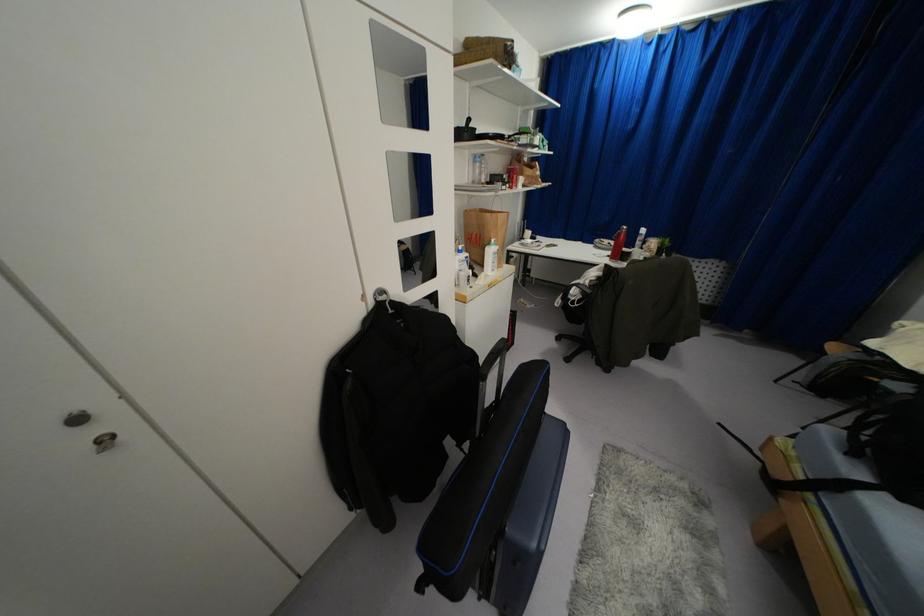
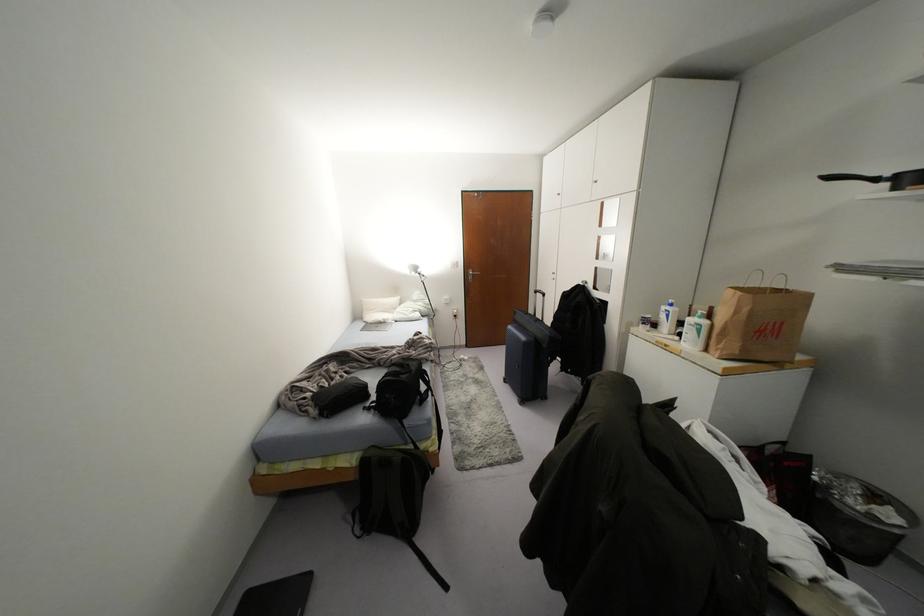
Where in the second image is the point corresponding to (468,120) from the first image?

(829, 177)